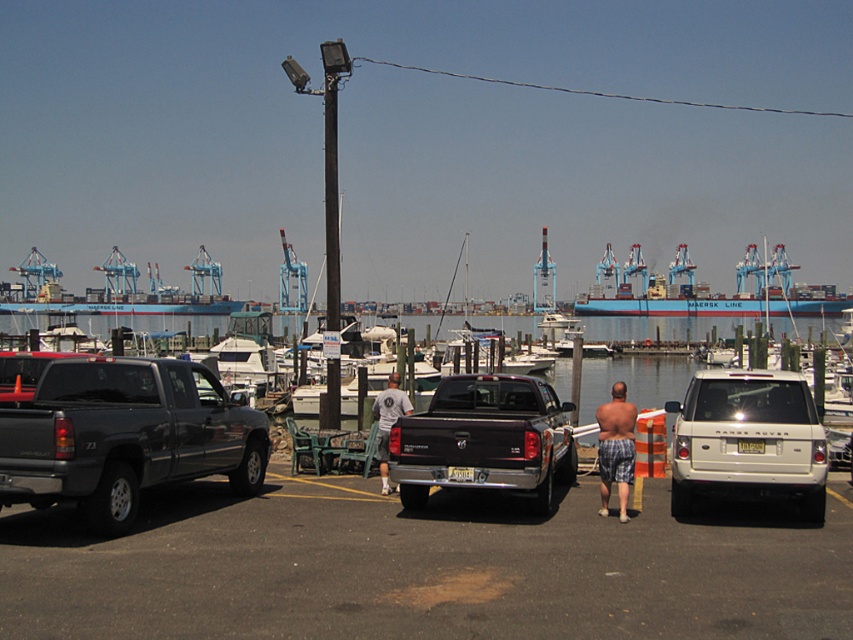
Question: Does black matte truck at center have a larger size compared to blue plaid shorts at center?

Choices:
 (A) no
 (B) yes

Answer: (B)

Question: Which is nearer to the white cotton shirt at center?

Choices:
 (A) black matte truck at center
 (B) white matte suv at center
 (C) blue matte container ship at center
 (D) matte black truck at left

Answer: (A)

Question: Which of these objects is positioned closest to the blue plaid shorts at center?

Choices:
 (A) white matte suv at center
 (B) blue matte container ship at center
 (C) white cotton shirt at center

Answer: (A)

Question: Considering the real-world distances, which object is closest to the matte black truck at left?

Choices:
 (A) white cotton shirt at center
 (B) blue matte container ship at center
 (C) white matte suv at center

Answer: (A)

Question: Is the position of white matte suv at center more distant than that of blue matte container ship at center?

Choices:
 (A) no
 (B) yes

Answer: (A)

Question: Can you confirm if blue matte container ship at center is positioned to the right of blue plaid shorts at center?

Choices:
 (A) no
 (B) yes

Answer: (B)